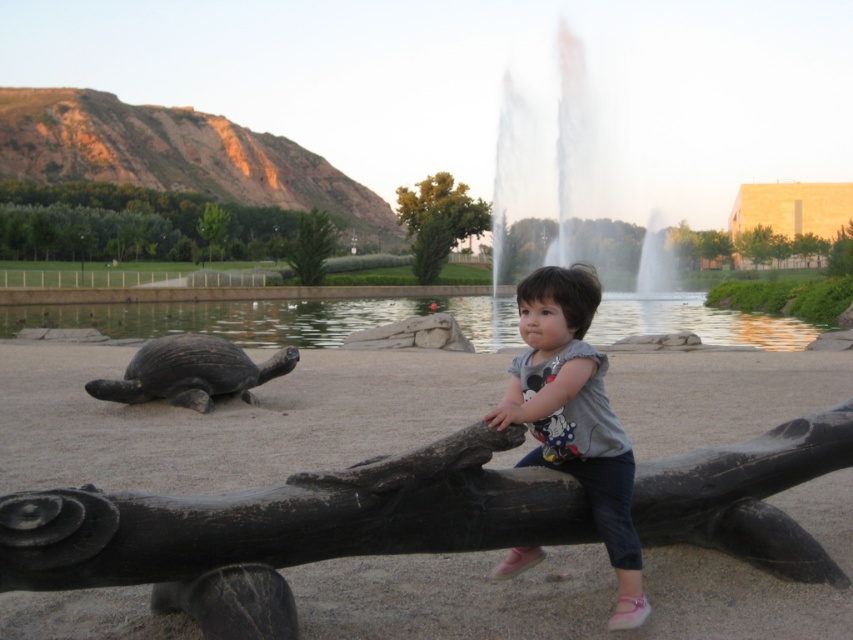
You are a photographer trying to capture the child interacting with the turtle sculpture. You notice the transparent glass water at upper center and the matte gray shirt at center. Which object should you focus on first to ensure the child is in sharp focus?

The matte gray shirt at center is behind the transparent glass water at upper center, so focusing on the matte gray shirt at center first will ensure the child is in sharp focus since it is closer to the camera.

You are standing at the origin point in the image. The turtle sculpture is at position 0.5,0.5. Can you determine the direction to the matte gray shirt at center from the turtle sculpture?

The matte gray shirt at center is located at 2D coordinates (x=575, y=416). Since the turtle sculpture is at (x=426, y=320), the shirt is northeast of the turtle sculpture. To reach the shirt from the turtle, move northeast.

You are a park visitor who wants to place a small bench between the smooth dark wood log at center and the transparent glass water at upper center. Considering their widths, can you fit the bench there?

The smooth dark wood log at center is narrower than the transparent glass water at upper center. Since the log is narrower, there might be enough space between them to fit the bench, but you should measure the exact distance to be sure.